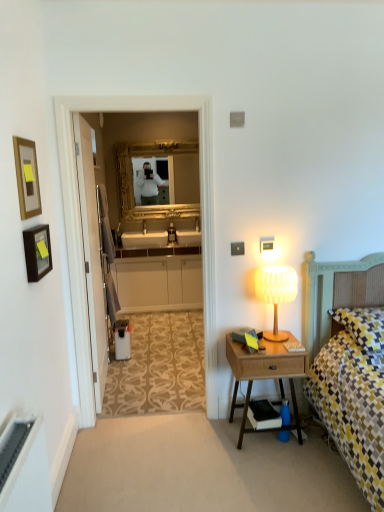
Identify the location of vacant area to the left of woodenmaterial/texturenightstand at right. (217, 439).